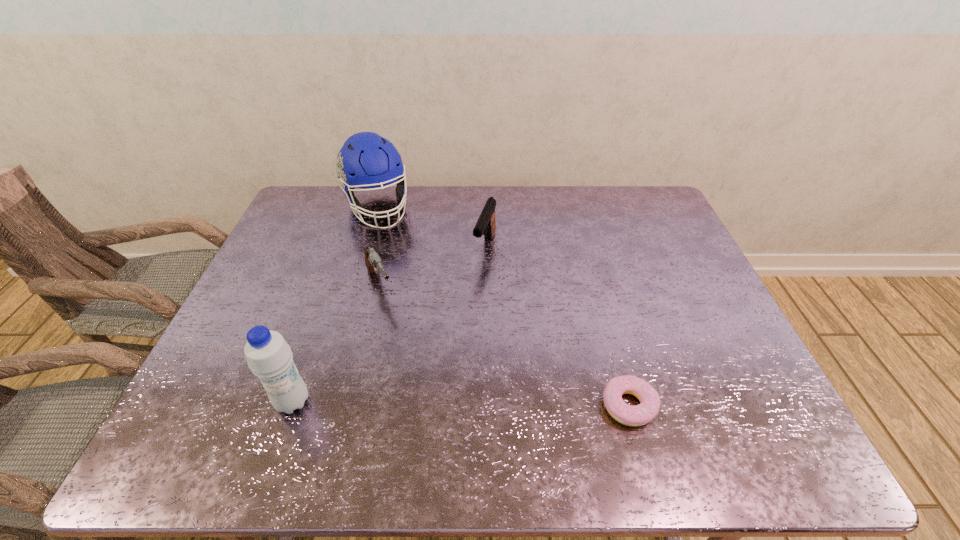
You are a GUI agent. You are given a task and a screenshot of the screen. Output one action in this format:
    pyautogui.click(x=<x>, y=<y>)
    Task: Click on the free space between the second shortest object and the water bottle
    
    Given the screenshot: What is the action you would take?
    pyautogui.click(x=336, y=343)

Locate an element on the screen. The height and width of the screenshot is (540, 960). empty space that is in between the left pistol and the football helmet is located at coordinates (378, 246).

Locate an element on the screen. free spot between the water bottle and the shorter pistol is located at coordinates (336, 343).

Locate an element on the screen. vacant space that is in between the shorter pistol and the football helmet is located at coordinates (378, 246).

Image resolution: width=960 pixels, height=540 pixels. In order to click on empty space that is in between the shortest object and the water bottle in this screenshot , I will do `click(461, 403)`.

The width and height of the screenshot is (960, 540). Find the location of `vacant area that lies between the water bottle and the left pistol`. vacant area that lies between the water bottle and the left pistol is located at coordinates (336, 343).

Where is `vacant space that's between the water bottle and the taller pistol`? Image resolution: width=960 pixels, height=540 pixels. vacant space that's between the water bottle and the taller pistol is located at coordinates (389, 325).

Find the location of a particular element. free area in between the shortest object and the shorter pistol is located at coordinates (505, 345).

Where is `the third closest object to the right pistol`? This screenshot has height=540, width=960. the third closest object to the right pistol is located at coordinates click(x=641, y=414).

Locate which object ranks second in proximity to the left pistol. Please provide its 2D coordinates. Your answer should be formatted as a tuple, i.e. [(x, y)], where the tuple contains the x and y coordinates of a point satisfying the conditions above.

[(486, 225)]